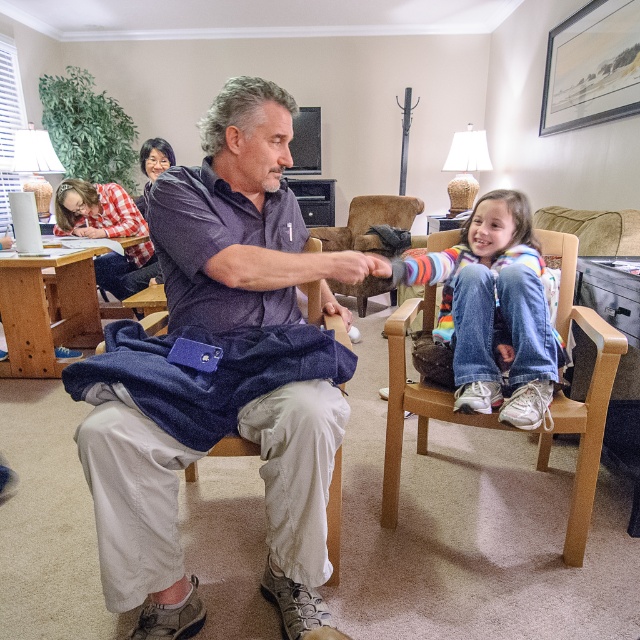
You are designing a layout for a small living room and need to place both the jeans at lower right and the khaki fabric armchair at center. Which item should you prioritize placing first if you want to ensure there is enough space for both?

You should prioritize placing the khaki fabric armchair at center first because the jeans at lower right occupies less space, so it can be arranged around the larger item without issue.

You are a photographer setting up a shoot in the living room. You need to position a large camera tripod between the jeans at lower right and the khaki fabric armchair at center. Based on their positions, can the tripod be placed between them without overlapping either object?

The jeans at lower right is above the khaki fabric armchair at center, so there is vertical space between them. However, since the tripod requires horizontal space, it cannot be placed between them as they are vertically aligned.